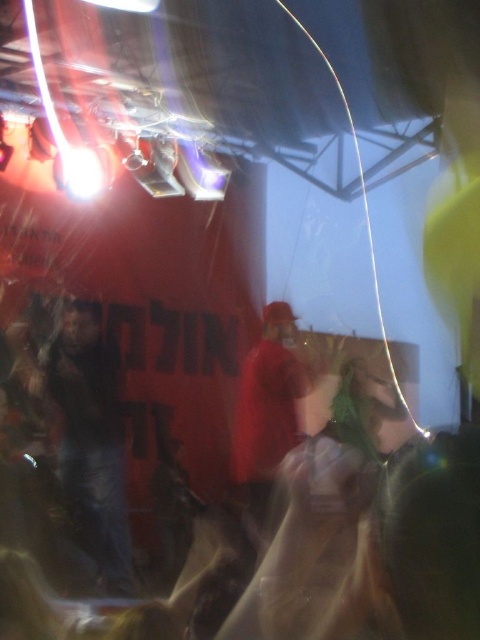
Does dark blue jeans at center lie behind red fabric cap at center?

No.

Which of these two, dark blue jeans at center or red fabric cap at center, stands shorter?

Standing shorter between the two is red fabric cap at center.

Measure the distance between point (60, 403) and camera.

12.55 feet

Locate an element on the screen. This screenshot has height=640, width=480. dark blue jeans at center is located at coordinates (90, 440).